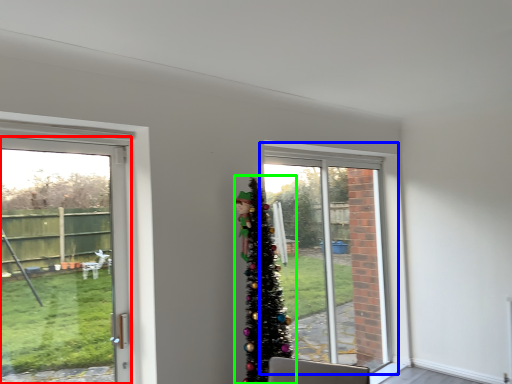
Question: Considering the real-world distances, which object is farthest from door (highlighted by a red box)? window (highlighted by a blue box) or christmas tree (highlighted by a green box)?

Choices:
 (A) window
 (B) christmas tree

Answer: (A)